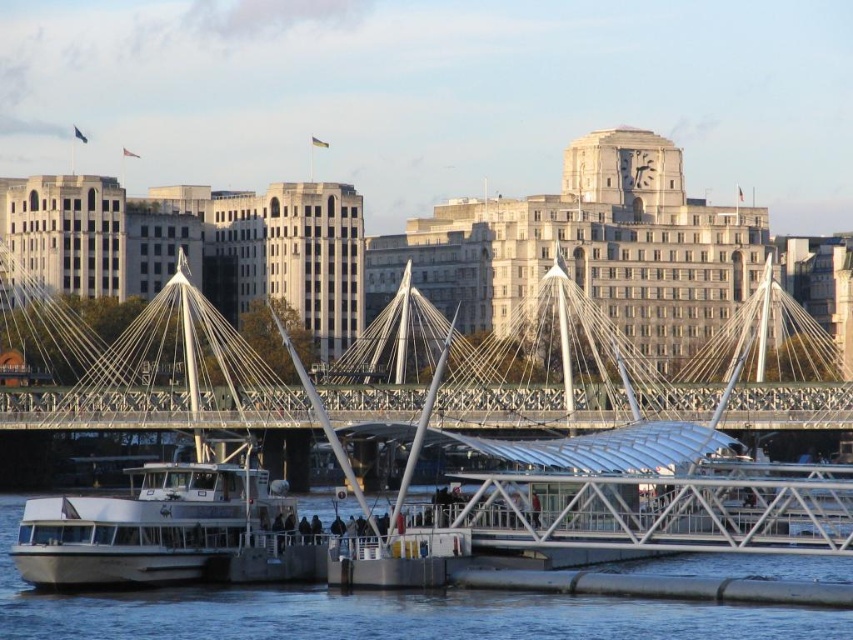
Does clear water at lower center have a smaller size compared to white matte boat at lower left?

Correct, clear water at lower center occupies less space than white matte boat at lower left.

Does clear water at lower center have a lesser width compared to white matte boat at lower left?

No, clear water at lower center is not thinner than white matte boat at lower left.

From the picture: Who is more distant from viewer, (460, 630) or (187, 577)?

Point (187, 577)

Image resolution: width=853 pixels, height=640 pixels. I want to click on clear water at lower center, so (x=376, y=612).